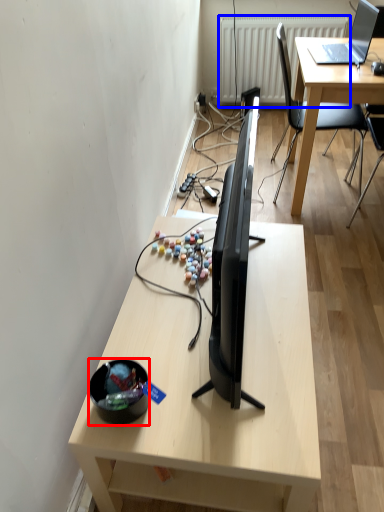
Question: Among these objects, which one is farthest to the camera, bowl (highlighted by a red box) or radiator (highlighted by a blue box)?

Choices:
 (A) bowl
 (B) radiator

Answer: (B)